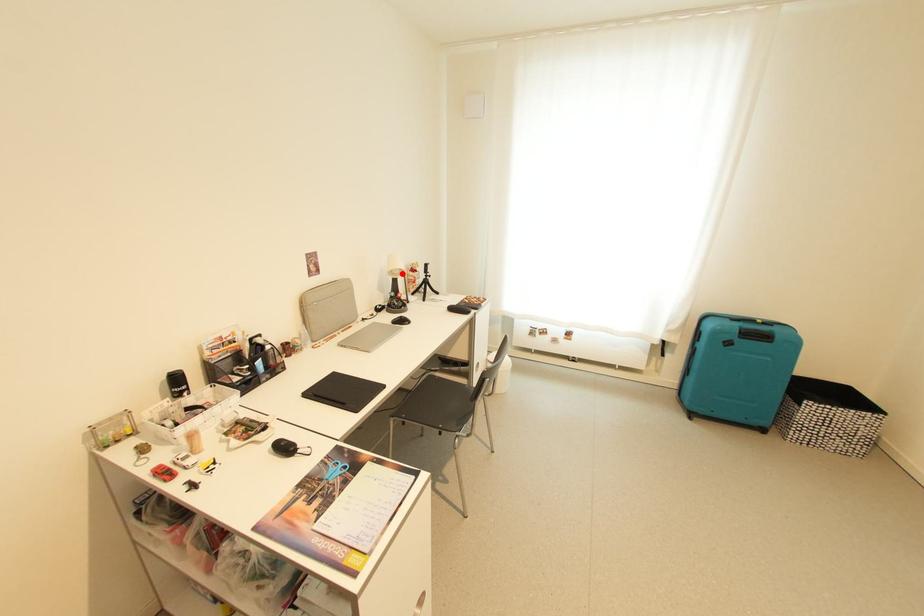
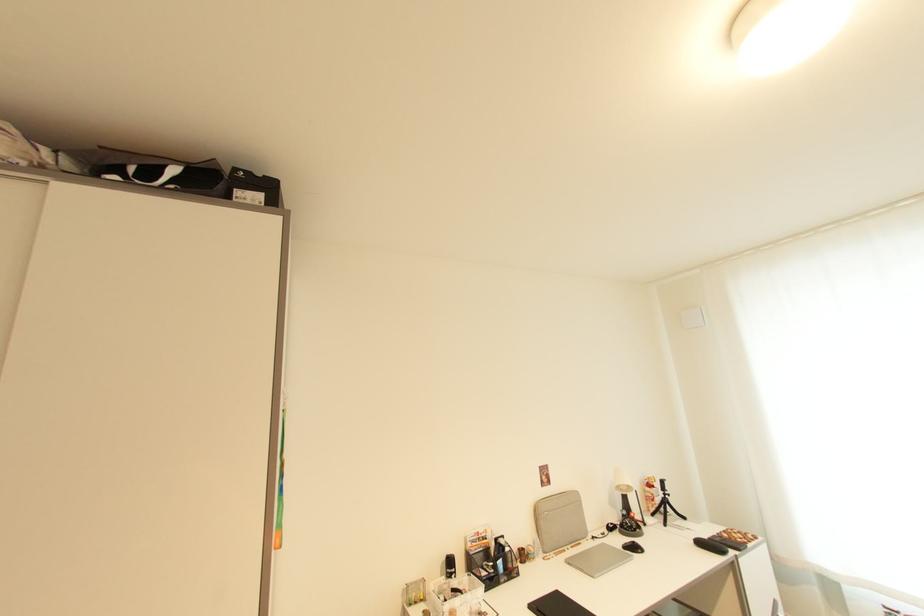
The point at the highlighted location is marked in the first image. Where is the corresponding point in the second image?

(629, 490)